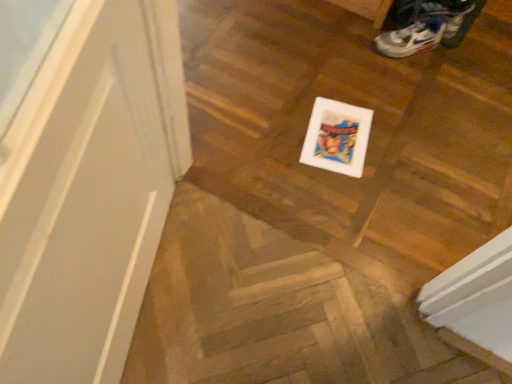
Question: Relative to wooden floor at center, is white mesh shoe at upper right in front or behind?

Choices:
 (A) front
 (B) behind

Answer: (B)

Question: Considering the positions of white mesh shoe at upper right and wooden floor at center in the image, is white mesh shoe at upper right wider or thinner than wooden floor at center?

Choices:
 (A) thin
 (B) wide

Answer: (A)

Question: Is white mesh shoe at upper right taller or shorter than wooden floor at center?

Choices:
 (A) tall
 (B) short

Answer: (A)

Question: Relative to white mesh shoe at upper right, is wooden floor at center in front or behind?

Choices:
 (A) front
 (B) behind

Answer: (A)

Question: Is point (194, 374) closer or farther from the camera than point (423, 18)?

Choices:
 (A) closer
 (B) farther

Answer: (A)

Question: From the image's perspective, is wooden floor at center above or below white mesh shoe at upper right?

Choices:
 (A) above
 (B) below

Answer: (B)

Question: In the image, is wooden floor at center on the left side or the right side of white mesh shoe at upper right?

Choices:
 (A) right
 (B) left

Answer: (B)